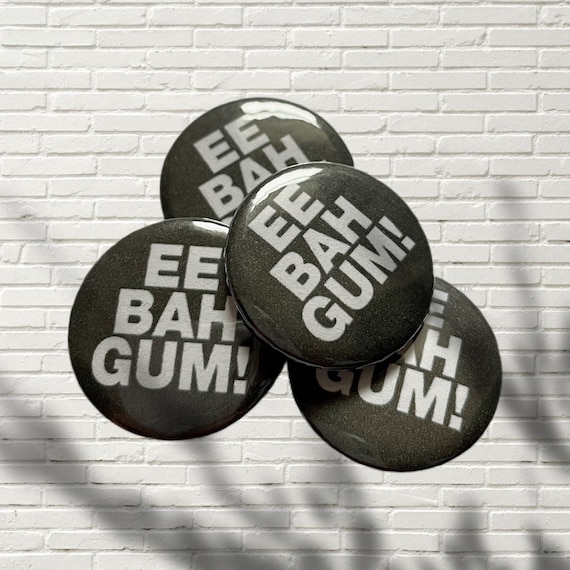
At what (x,y) coordinates should I click in order to perform the action: click on white wall. Please return your answer as a coordinate pair (x, y). Image resolution: width=570 pixels, height=570 pixels. Looking at the image, I should click on (250, 55).